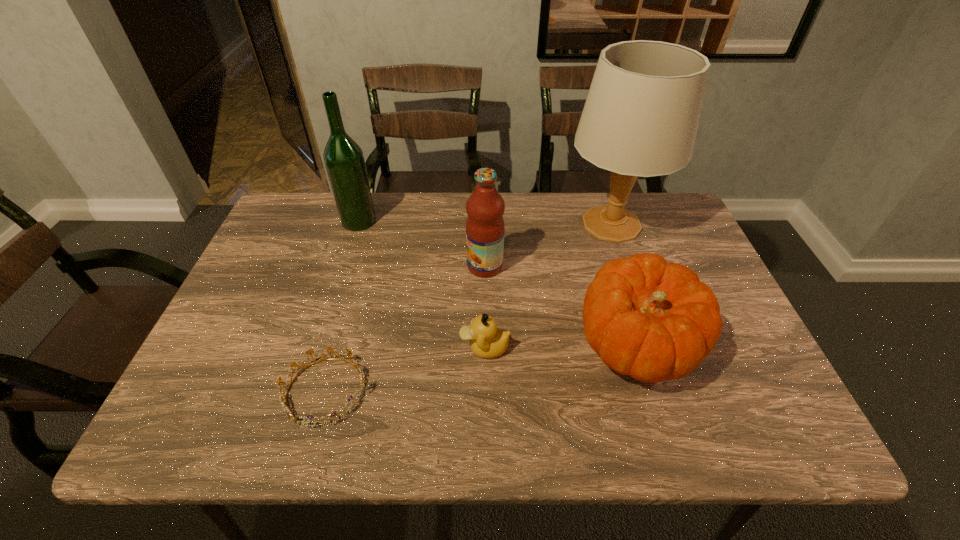
Identify the location of free spot between the tallest object and the tiara. Image resolution: width=960 pixels, height=540 pixels. pyautogui.click(x=468, y=308).

Identify the location of vacant point located between the duckling and the tallest object. (548, 286).

This screenshot has width=960, height=540. I want to click on free space between the fruit juice and the alcohol, so click(x=421, y=244).

This screenshot has height=540, width=960. I want to click on blank region between the fourth shortest object and the table lamp, so click(x=548, y=245).

In order to click on free space between the pumpkin and the third tallest object in this screenshot , I will do `click(562, 306)`.

Where is `vacant region between the tiara and the duckling`? This screenshot has height=540, width=960. vacant region between the tiara and the duckling is located at coordinates (405, 369).

Locate which object is the closest to the fruit juice. Please provide its 2D coordinates. Your answer should be formatted as a tuple, i.e. [(x, y)], where the tuple contains the x and y coordinates of a point satisfying the conditions above.

[(652, 320)]

Identify the location of object that stands as the closest to the pumpkin. (641, 115).

Locate an element on the screen. The height and width of the screenshot is (540, 960). vacant region that satisfies the following two spatial constraints: 1. on the front side of the pumpkin; 2. on the face of the fifth tallest object is located at coordinates (638, 348).